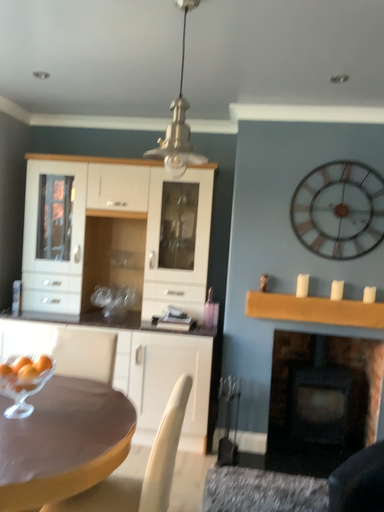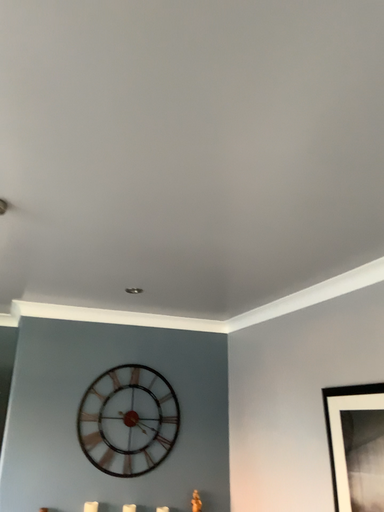
Question: How did the camera likely rotate when shooting the video?

Choices:
 (A) rotated right
 (B) rotated left

Answer: (A)